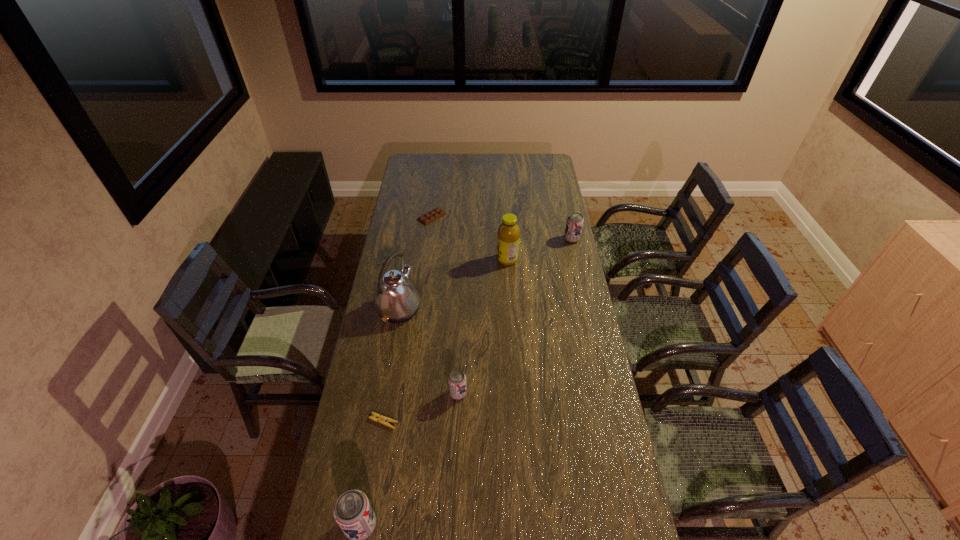
Where is `vacant space situated on the right of the third nearest object`? The image size is (960, 540). vacant space situated on the right of the third nearest object is located at coordinates (509, 393).

At what (x,y) coordinates should I click in order to perform the action: click on vacant area situated on the front of the fourth tallest object. Please return your answer as a coordinate pair (x, y). Looking at the image, I should click on (575, 252).

Locate an element on the screen. The height and width of the screenshot is (540, 960). free location located on the right of the chocolate bar is located at coordinates tap(510, 217).

The width and height of the screenshot is (960, 540). Find the location of `free spot located on the front label of the sixth object from left to right`. free spot located on the front label of the sixth object from left to right is located at coordinates (468, 260).

Find the location of a particular element. vacant space located on the front label of the sixth object from left to right is located at coordinates (482, 260).

This screenshot has height=540, width=960. I want to click on free region located on the front label of the sixth object from left to right, so click(x=484, y=260).

At what (x,y) coordinates should I click in order to perform the action: click on vacant space positioned on the right of the clothespin. Please return your answer as a coordinate pair (x, y). This screenshot has width=960, height=540. Looking at the image, I should click on (504, 421).

Find the location of a particular element. The height and width of the screenshot is (540, 960). vacant space situated on the back of the kettle is located at coordinates (412, 234).

The image size is (960, 540). Identify the location of chocolate bar at the left edge. (433, 215).

Identify the location of clothespin present at the left edge. (381, 419).